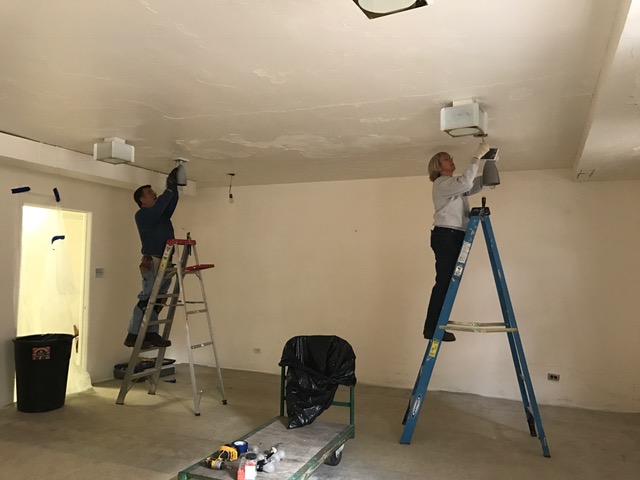
Find the location of a particular element. The width and height of the screenshot is (640, 480). lights is located at coordinates (379, 6), (464, 124), (490, 172), (109, 150), (180, 179), (230, 199).